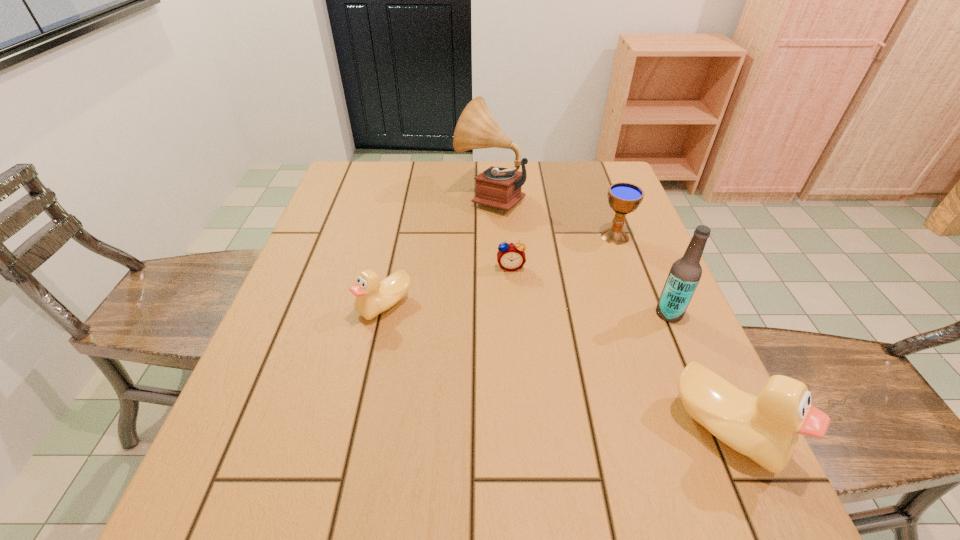
The width and height of the screenshot is (960, 540). I want to click on free spot between the phonograph record and the shortest object, so click(500, 231).

Where is `object that is the fourth nearest to the fourth tallest object`? object that is the fourth nearest to the fourth tallest object is located at coordinates (766, 429).

Identify which object is located as the nearest to the fourth shortest object. Please provide its 2D coordinates. Your answer should be formatted as a tuple, i.e. [(x, y)], where the tuple contains the x and y coordinates of a point satisfying the conditions above.

[(685, 273)]

This screenshot has height=540, width=960. Find the location of `vacant position in the image that satisfies the following two spatial constraints: 1. on the back side of the third shortest object; 2. on the horn of the phonograph record`. vacant position in the image that satisfies the following two spatial constraints: 1. on the back side of the third shortest object; 2. on the horn of the phonograph record is located at coordinates (600, 196).

Locate an element on the screen. This screenshot has width=960, height=540. free location that satisfies the following two spatial constraints: 1. on the front-facing side of the fourth nearest object; 2. at the beak of the farther duck is located at coordinates (514, 305).